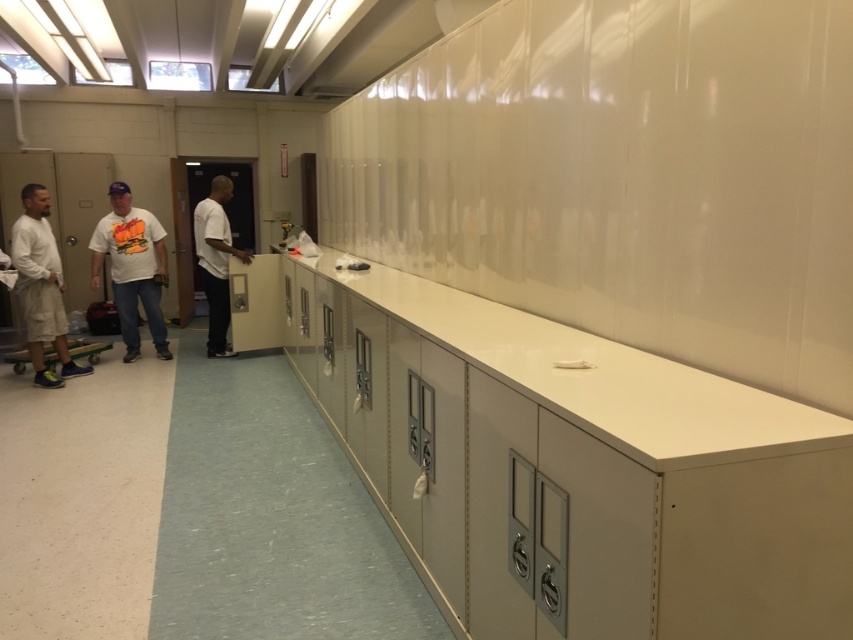
Is matte khaki shorts at left below white matte shirt at center?

Yes, matte khaki shorts at left is below white matte shirt at center.

At what (x,y) coordinates should I click in order to perform the action: click on matte khaki shorts at left. Please return your answer as a coordinate pair (x, y). The image size is (853, 640). Looking at the image, I should click on (41, 288).

Image resolution: width=853 pixels, height=640 pixels. In order to click on matte khaki shorts at left in this screenshot , I will do `click(41, 288)`.

Consider the image. Between white matte t-shirt at center and green rubber skateboard at lower left, which one is positioned lower?

green rubber skateboard at lower left

Is the position of white matte t-shirt at center less distant than that of green rubber skateboard at lower left?

No, white matte t-shirt at center is behind green rubber skateboard at lower left.

Who is more distant from viewer, (137,244) or (4,355)?

The point (137,244) is behind.

Image resolution: width=853 pixels, height=640 pixels. Find the location of `white matte t-shirt at center`. white matte t-shirt at center is located at coordinates (132, 268).

Can you confirm if white matte t-shirt at center is shorter than white matte shirt at center?

Yes.

Can you confirm if white matte t-shirt at center is positioned below white matte shirt at center?

Yes.

Identify the location of white matte t-shirt at center. The image size is (853, 640). (132, 268).